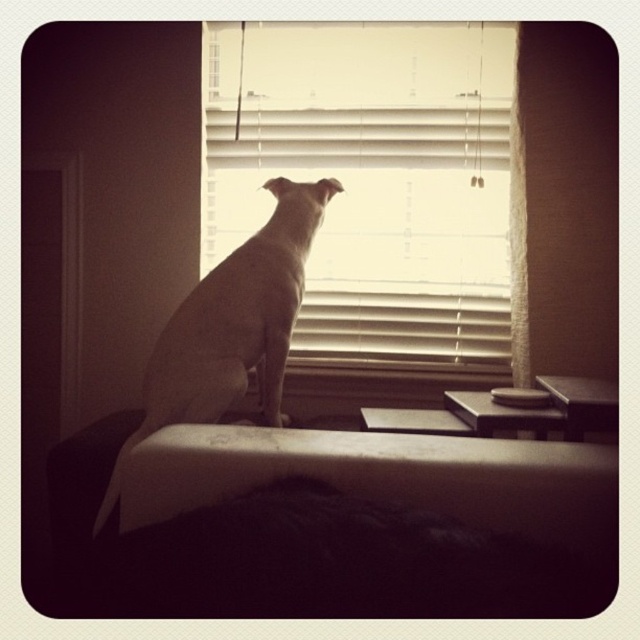
Is white fabric bed at center thinner than white smooth dog at center?

Incorrect, white fabric bed at center's width is not less than white smooth dog at center's.

What do you see at coordinates (294, 554) in the screenshot? Image resolution: width=640 pixels, height=640 pixels. I see `white fabric bed at center` at bounding box center [294, 554].

The image size is (640, 640). What are the coordinates of `white fabric bed at center` in the screenshot? It's located at (294, 554).

Can you confirm if white blinds at center is taller than white fabric bed at center?

Indeed, white blinds at center has a greater height compared to white fabric bed at center.

Which of these two, white blinds at center or white fabric bed at center, stands shorter?

white fabric bed at center

Which is behind, point (448, 179) or point (595, 595)?

Positioned behind is point (448, 179).

The height and width of the screenshot is (640, 640). Find the location of `white blinds at center`. white blinds at center is located at coordinates (374, 177).

Between white blinds at center and white smooth dog at center, which one is positioned lower?

white smooth dog at center is lower down.

Measure the distance between white blinds at center and camera.

The distance of white blinds at center from camera is 2.10 meters.

Identify the location of white blinds at center. This screenshot has height=640, width=640. pyautogui.click(x=374, y=177).